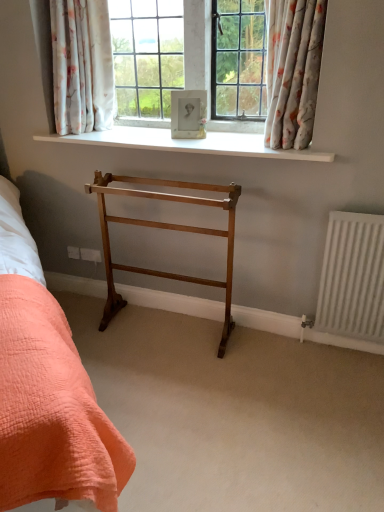
The image size is (384, 512). What are the coordinates of `vacant space in floral fabric curtain at upper center, marked as the 1th curtain in a left-to-right arrangement (from a real-world perspective)` in the screenshot? It's located at (97, 134).